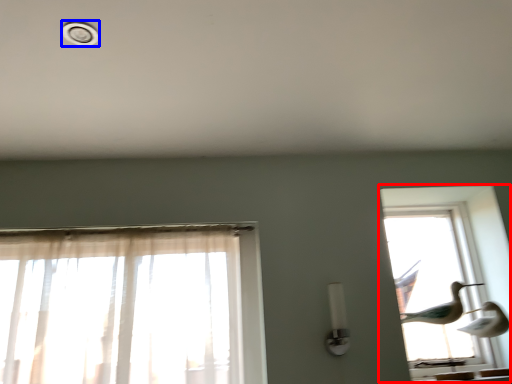
Question: Which object appears farthest to the camera in this image, window (highlighted by a red box) or dot (highlighted by a blue box)?

Choices:
 (A) window
 (B) dot

Answer: (A)